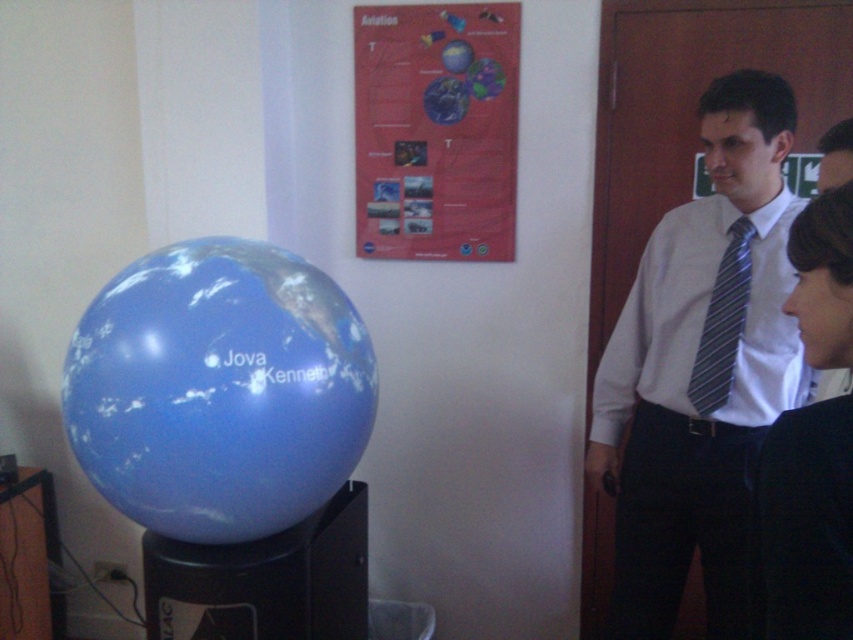
You are a visitor at a museum and see the white shirt with tie at right and the red paper poster at upper center. Which object is positioned more to the right side of the image?

The white shirt with tie at right is positioned more to the right side of the image than the red paper poster at upper center.

You are a visitor at a museum and notice the white shirt with tie at right and the red paper poster at upper center. Which object is bigger in size?

The white shirt with tie at right has a larger size compared to the red paper poster at upper center.

Based on the photo, you are a visitor in this room and want to know which object is wider between the white shirt with tie at right and the red paper poster at upper center. Can you tell me?

The white shirt with tie at right has a lesser width compared to the red paper poster at upper center, so the red paper poster at upper center is wider.